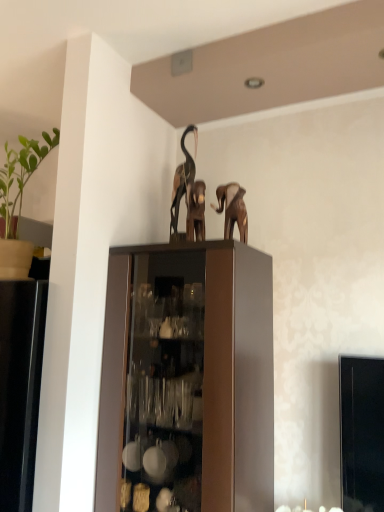
Question: Is wooden elephant at center, the second animal from the back, taller or shorter than metallic brown elephant at upper center, which is the 1th animal in back-to-front order?

Choices:
 (A) short
 (B) tall

Answer: (A)

Question: Is wooden elephant at center, which is the first animal in front-to-back order, spatially inside metallic brown elephant at upper center, marked as the second animal in a front-to-back arrangement, or outside of it?

Choices:
 (A) outside
 (B) inside

Answer: (A)

Question: Estimate the real-world distances between objects in this image. Which object is farther from the green matte plant at left?

Choices:
 (A) wooden elephant at center, the second animal from the back
 (B) metallic brown elephant at upper center, marked as the second animal in a front-to-back arrangement
 (C) brown matte elephant at upper center

Answer: (C)

Question: Estimate the real-world distances between objects in this image. Which object is farther from the brown matte elephant at upper center?

Choices:
 (A) wooden elephant at center, which is the first animal in front-to-back order
 (B) green matte plant at left
 (C) metallic brown elephant at upper center, which is the 1th animal in back-to-front order

Answer: (B)